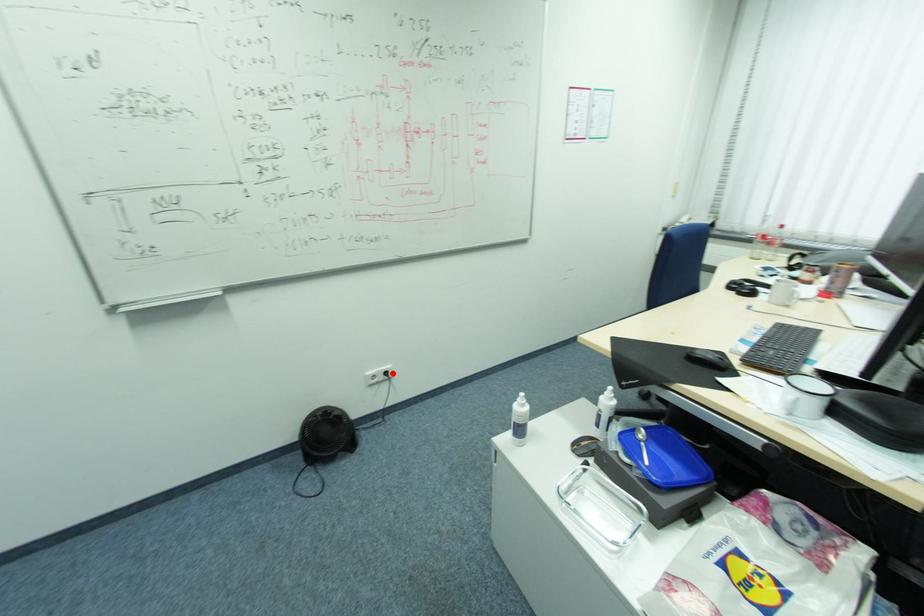
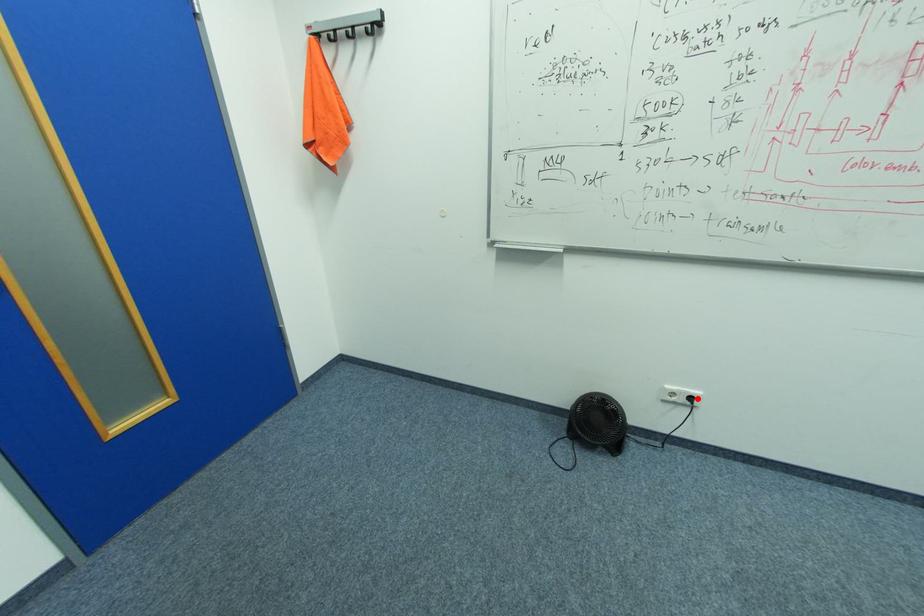
I am providing you with two images of the same scene from different viewpoints. A red point is marked on the first image and another point is marked on the second image. Is the red point in image1 aligned with the point shown in image2?

Yes